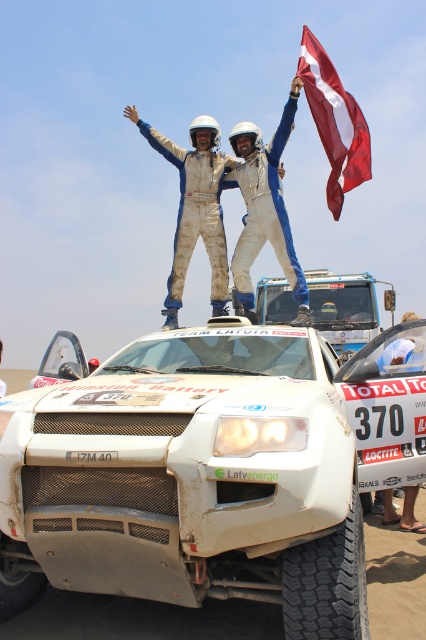
Question: Which of the following is the closest to the observer?

Choices:
 (A) (109, 579)
 (B) (270, 209)

Answer: (A)

Question: Is white fabric suit at center smaller than white fabric shirt at center?

Choices:
 (A) no
 (B) yes

Answer: (B)

Question: Which point appears farthest from the camera in this image?

Choices:
 (A) (276, 234)
 (B) (230, 589)
 (C) (348, 157)
 (D) (383, 344)

Answer: (C)

Question: Which object is positioned farthest from the red fabric flag at upper right?

Choices:
 (A) white matte rally car at center
 (B) white textured jumpsuit at center
 (C) white fabric suit at center

Answer: (A)

Question: Is white fabric suit at center to the right of white fabric shirt at center from the viewer's perspective?

Choices:
 (A) no
 (B) yes

Answer: (A)

Question: Is white matte rally car at center above white fabric shirt at center?

Choices:
 (A) no
 (B) yes

Answer: (A)